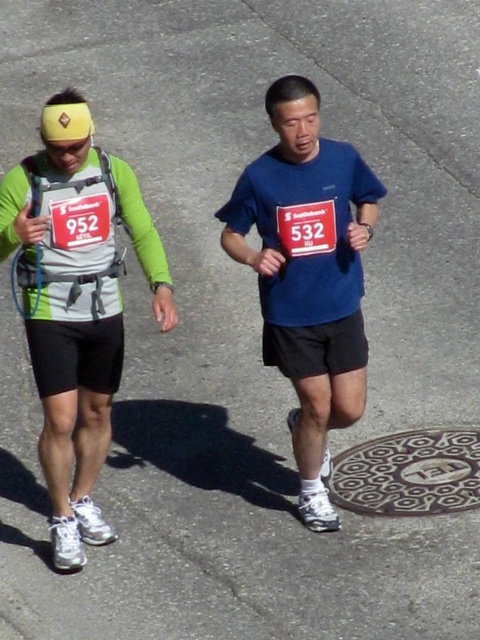
Question: Can you confirm if matte green shirt at left is bigger than metallic textured manhole cover at lower center?

Choices:
 (A) yes
 (B) no

Answer: (A)

Question: In this image, where is matte green shirt at left located relative to blue matte shirt at center?

Choices:
 (A) above
 (B) below

Answer: (B)

Question: Among these objects, which one is nearest to the camera?

Choices:
 (A) matte green shirt at left
 (B) metallic textured manhole cover at lower center
 (C) blue matte shirt at center

Answer: (A)

Question: Which of the following is the closest to the observer?

Choices:
 (A) (26, 264)
 (B) (326, 202)

Answer: (A)

Question: Among these objects, which one is farthest from the camera?

Choices:
 (A) blue matte shirt at center
 (B) metallic textured manhole cover at lower center
 (C) matte green shirt at left

Answer: (B)

Question: Does matte green shirt at left have a greater width compared to metallic textured manhole cover at lower center?

Choices:
 (A) no
 (B) yes

Answer: (B)